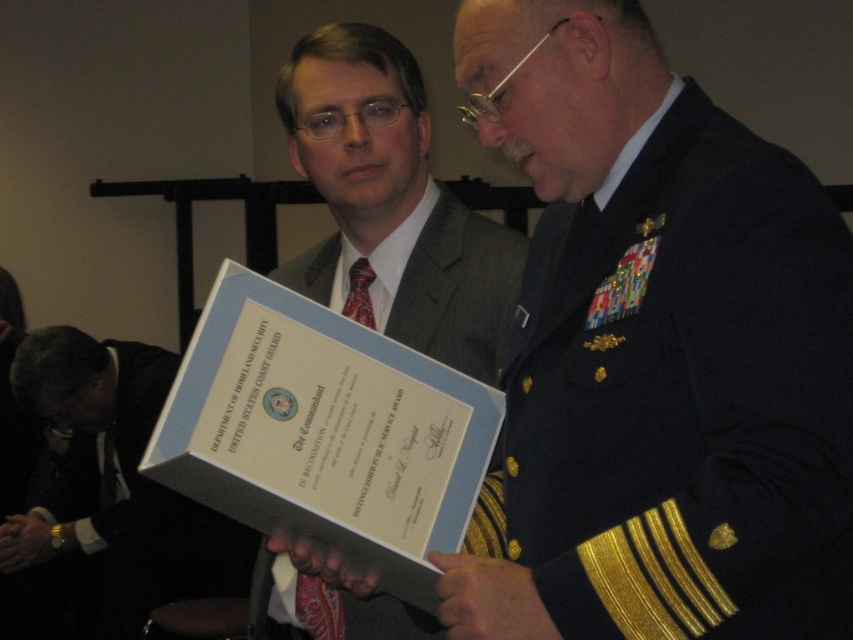
You are a photographer standing at the camera position. You want to take a photo of the point at coordinate point (416, 218). Can you reach that point with your camera lens? The camera has a focal length of 100mm and a sensor size of 24x36 mm. The minimum focusing distance of the camera is 1 meter.

The point at coordinate point (416, 218) is 5.65 feet away from the camera, which is approximately 1.72 meters. Since the minimum focusing distance is 1 meter, the camera can focus on the point as it is beyond the minimum distance.

You are a photographer at a formal event. You need to capture a photo of the two individuals wearing the matte black suit at center and the matte black suit at lower left. Which one has a narrower width?

The matte black suit at center is thinner than the matte black suit at lower left, so the matte black suit at center has a narrower width.